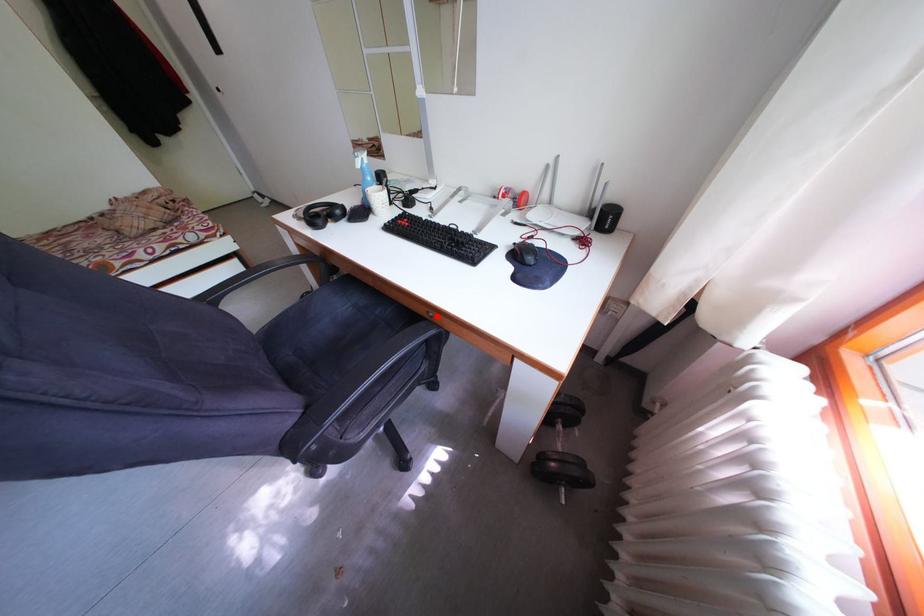
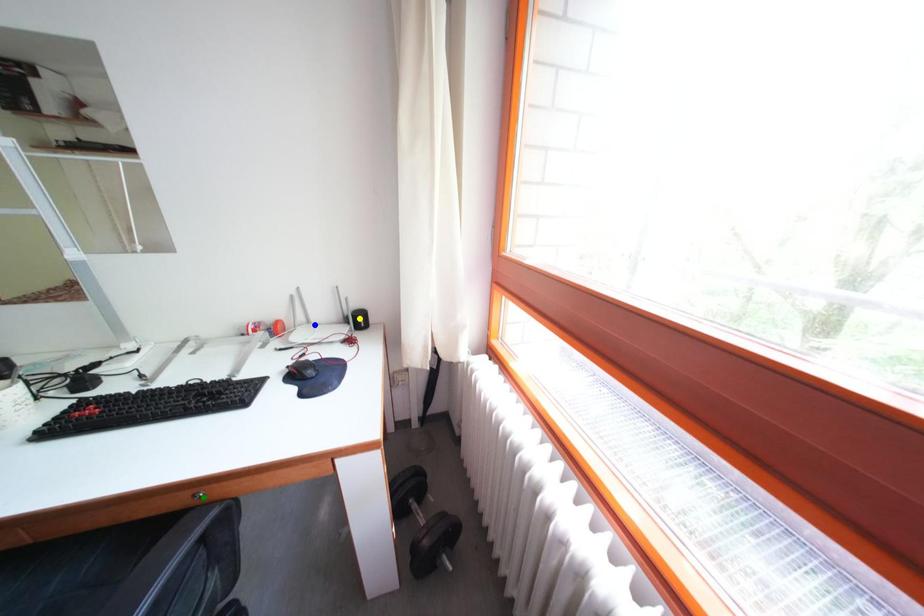
Question: I am providing you with two images of the same scene from different viewpoints. A red point is marked on the first image. You are given multiple points on the second image. Which mark in image 2 goes with the point in image 1?

Choices:
 (A) yellow point
 (B) blue point
 (C) green point

Answer: (C)